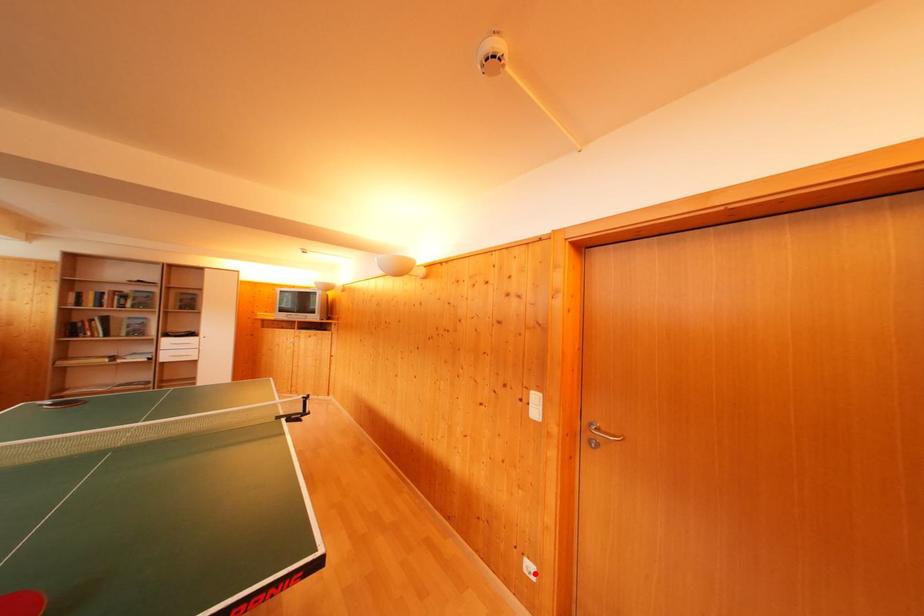
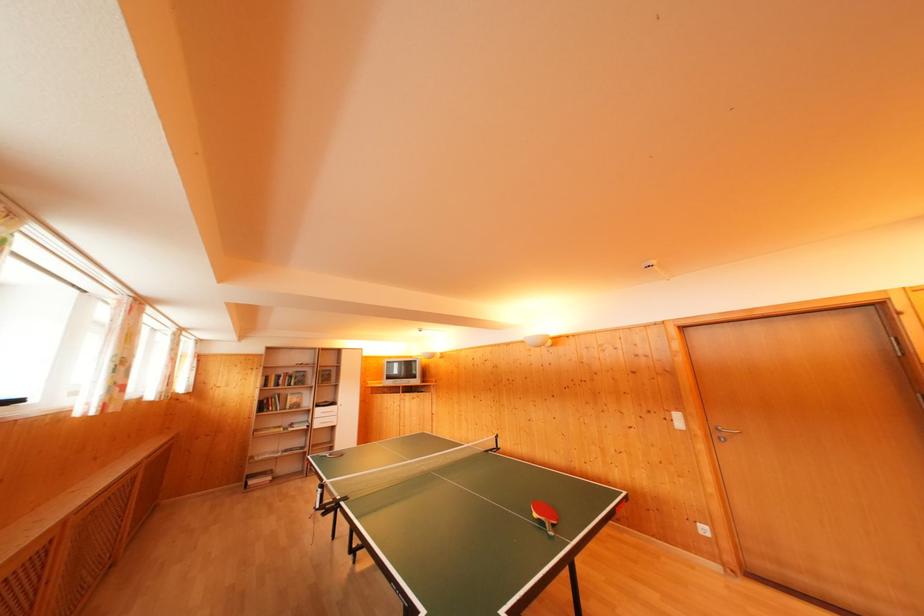
The point at the highlighted location is marked in the first image. Where is the corresponding point in the second image?

(709, 535)